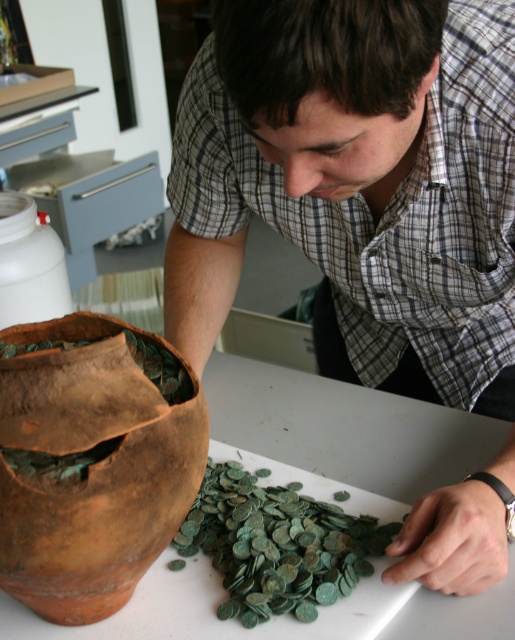
Question: Can you confirm if matte brown vase at left is positioned above white plastic bottle at left?

Choices:
 (A) yes
 (B) no

Answer: (B)

Question: Estimate the real-world distances between objects in this image. Which object is farther from the brown clay vase at lower left?

Choices:
 (A) white plastic bottle at left
 (B) green patinated coins at center

Answer: (A)

Question: Is matte brown vase at left above white plastic bottle at left?

Choices:
 (A) no
 (B) yes

Answer: (A)

Question: Which of these objects is positioned closest to the white plastic bottle at left?

Choices:
 (A) green patinated coins at center
 (B) matte brown vase at left
 (C) brown clay vase at lower left

Answer: (B)

Question: Does matte brown vase at left appear under green patinated coins at center?

Choices:
 (A) yes
 (B) no

Answer: (B)

Question: Which is farther from the white plastic bottle at left?

Choices:
 (A) brown clay vase at lower left
 (B) matte brown vase at left

Answer: (A)